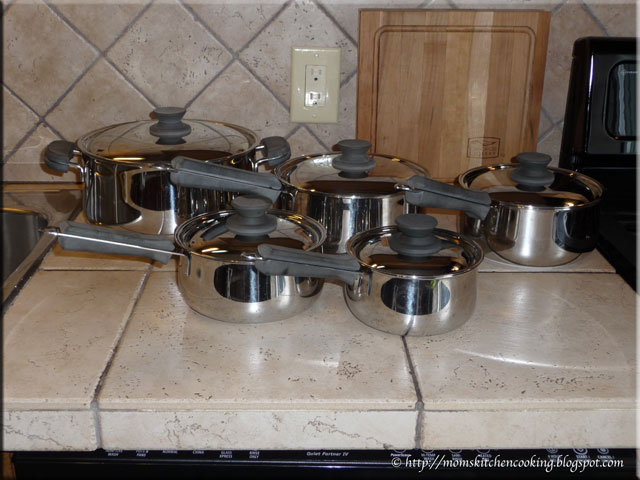
Find the location of `sink`. sink is located at coordinates coord(4,229).